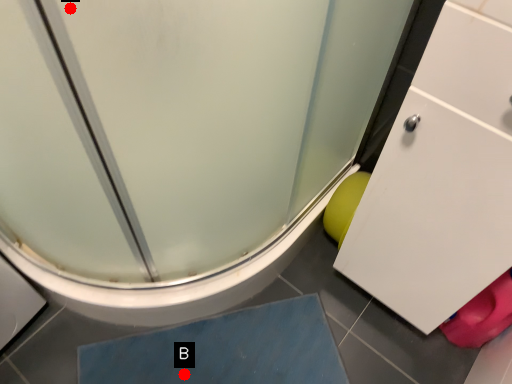
Question: Two points are circled on the image, labeled by A and B beside each circle. Among these points, which one is nearest to the camera?

Choices:
 (A) A is closer
 (B) B is closer

Answer: (A)